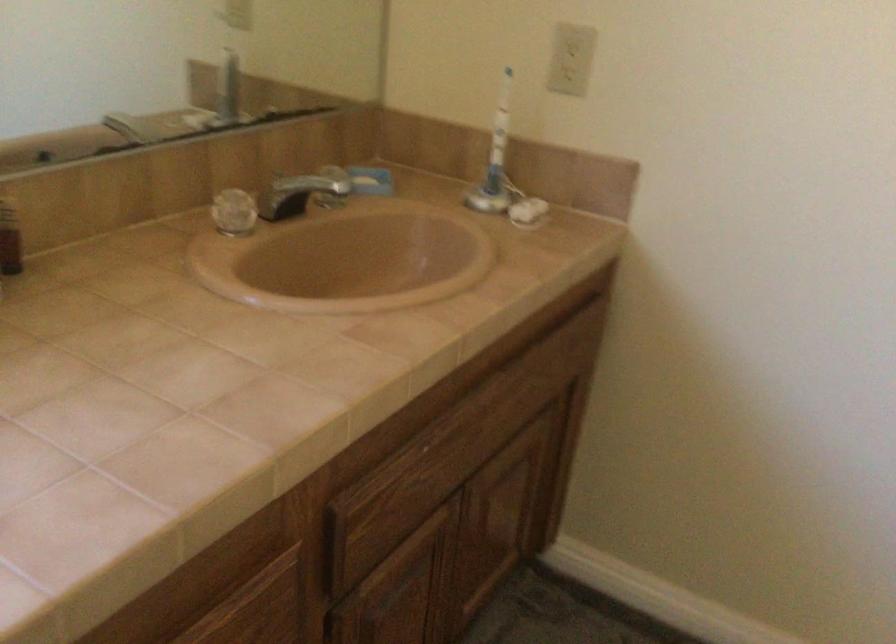
This screenshot has width=896, height=644. Identify the location of crystal ball. (234, 212).